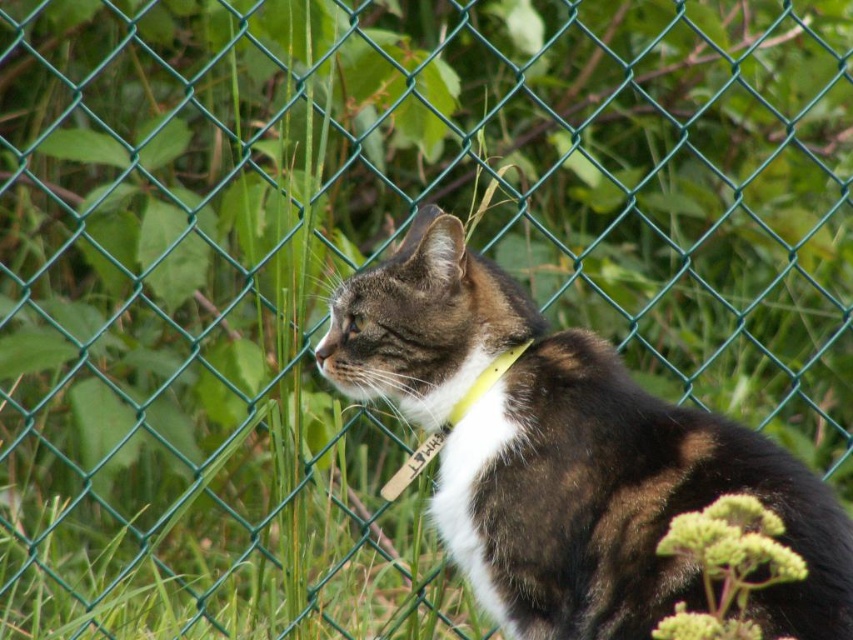
Question: Can you confirm if tabby fur cat at center is positioned to the left of green fuzzy plant at lower right?

Choices:
 (A) no
 (B) yes

Answer: (B)

Question: Which point is closer to the camera?

Choices:
 (A) green fuzzy plant at lower right
 (B) tabby fur cat at center

Answer: (A)

Question: Is tabby fur cat at center smaller than green fuzzy plant at lower right?

Choices:
 (A) no
 (B) yes

Answer: (A)

Question: Is tabby fur cat at center wider than green fuzzy plant at lower right?

Choices:
 (A) no
 (B) yes

Answer: (B)

Question: Which of the following is the farthest from the observer?

Choices:
 (A) (527, 442)
 (B) (672, 522)

Answer: (A)